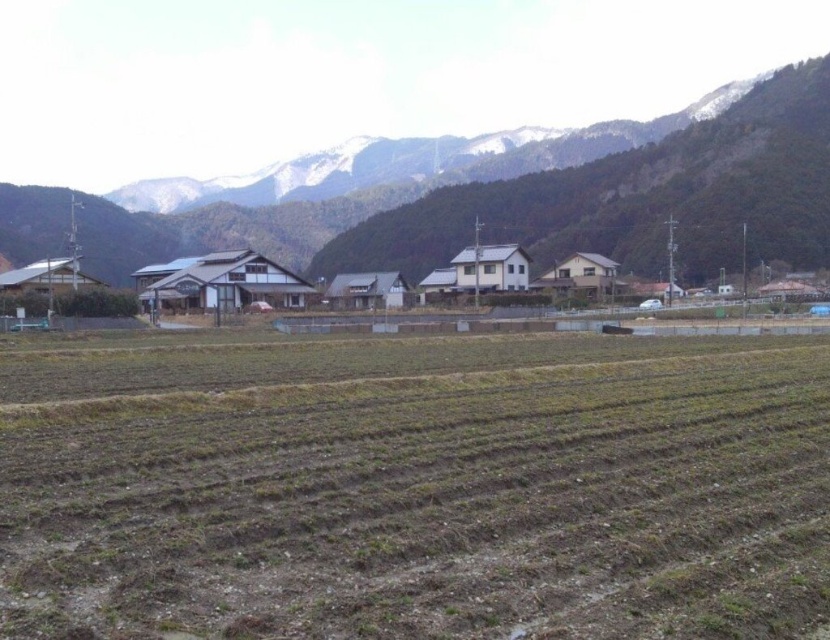
Question: Which object appears farthest from the camera in this image?

Choices:
 (A) snowy rock mountain at upper center
 (B) brown soil field at lower center

Answer: (A)

Question: Can you confirm if brown soil field at lower center is positioned to the right of snowy rock mountain at upper center?

Choices:
 (A) no
 (B) yes

Answer: (B)

Question: In this image, where is brown soil field at lower center located relative to snowy rock mountain at upper center?

Choices:
 (A) left
 (B) right

Answer: (B)

Question: Which point is closer to the camera?

Choices:
 (A) (652, 163)
 (B) (520, 580)

Answer: (B)

Question: Is the position of brown soil field at lower center less distant than that of snowy rock mountain at upper center?

Choices:
 (A) no
 (B) yes

Answer: (B)